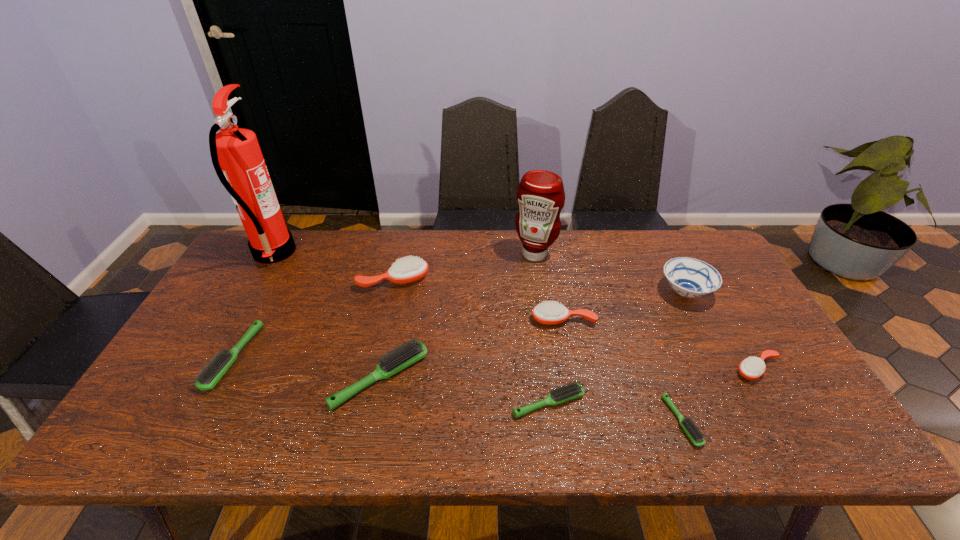
Where is `the leftmost light hairbrush`? This screenshot has height=540, width=960. the leftmost light hairbrush is located at coordinates (211, 374).

The image size is (960, 540). In order to click on the second biggest light hairbrush in this screenshot , I will do `click(211, 374)`.

Where is `the rightmost hairbrush`? The image size is (960, 540). the rightmost hairbrush is located at coordinates (751, 368).

This screenshot has width=960, height=540. Find the location of `the rightmost orange hairbrush`. the rightmost orange hairbrush is located at coordinates (751, 368).

This screenshot has height=540, width=960. I want to click on the third biggest light hairbrush, so click(x=574, y=390).

Image resolution: width=960 pixels, height=540 pixels. Identify the location of the sixth tallest hairbrush. (574, 390).

This screenshot has height=540, width=960. In order to click on the third object from right to left in this screenshot , I will do `click(695, 435)`.

Identify the location of the shortest hairbrush. Image resolution: width=960 pixels, height=540 pixels. (695, 435).

Identify the location of vacant area located 0.220m with the nozzle aimed from the tallest object. (360, 253).

At what (x,y) coordinates should I click in order to perform the action: click on vacant space located 0.060m on the left of the condiment. Please return your answer as a coordinate pair (x, y). The image size is (960, 540). Looking at the image, I should click on (495, 254).